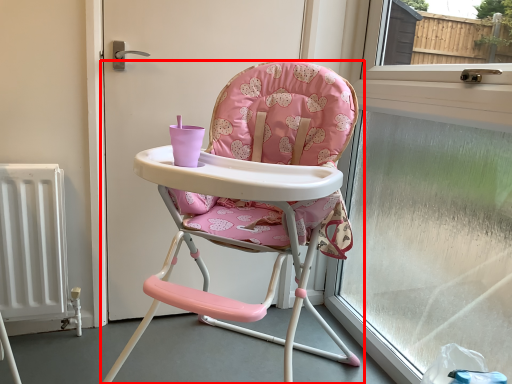
Question: From the image's perspective, where is chair (annotated by the red box) located relative to window frame?

Choices:
 (A) below
 (B) above

Answer: (A)